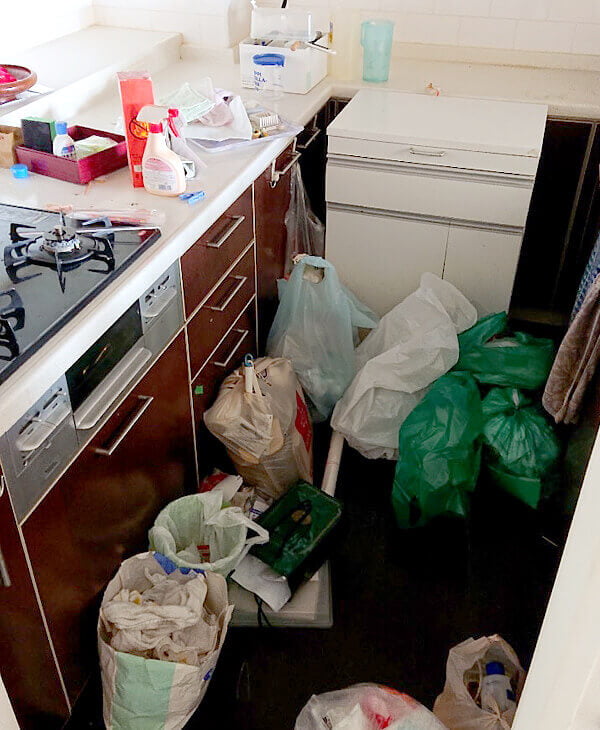
The height and width of the screenshot is (730, 600). What are the coordinates of `brown top drawer` in the screenshot? It's located at (196, 266).